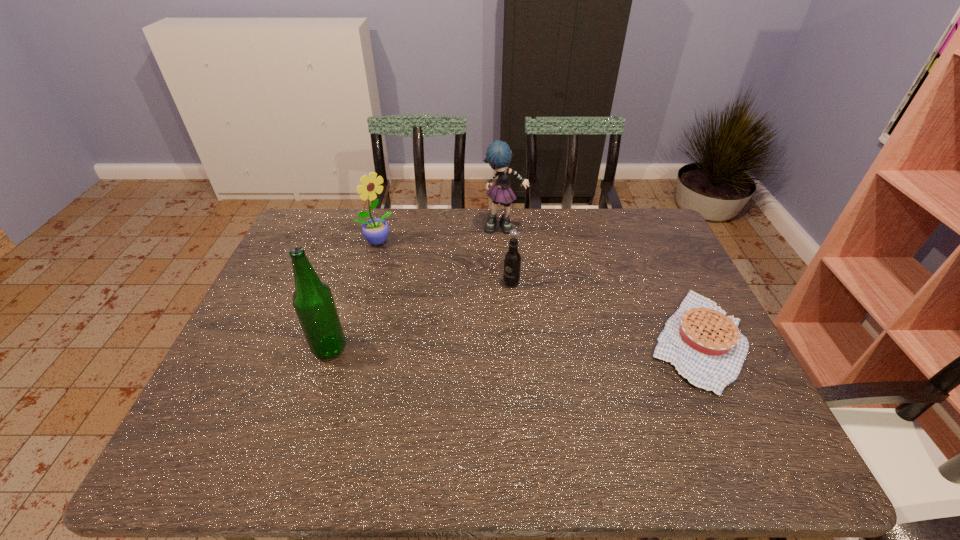
You are a GUI agent. You are given a task and a screenshot of the screen. Output one action in this format:
    pyautogui.click(x=<x>, y=<y>)
    Task: Click on the sunflower that is at the far edge
    This screenshot has height=540, width=960.
    Given the screenshot: What is the action you would take?
    pyautogui.click(x=375, y=231)

Locate an element on the screen. This screenshot has width=960, height=540. object that is at the near edge is located at coordinates (706, 347).

Image resolution: width=960 pixels, height=540 pixels. In order to click on object that is at the right edge in this screenshot , I will do `click(706, 347)`.

Locate an element on the screen. This screenshot has width=960, height=540. object located at the near right corner is located at coordinates (706, 347).

The height and width of the screenshot is (540, 960). I want to click on vacant space at the far edge of the desktop, so coord(586,220).

The image size is (960, 540). In the image, there is a desktop. In order to click on free space at the left edge in this screenshot , I will do `click(236, 359)`.

What are the coordinates of `vacant space at the right edge of the desktop` in the screenshot? It's located at [638, 276].

This screenshot has height=540, width=960. I want to click on free region at the far left corner, so coord(315,250).

Image resolution: width=960 pixels, height=540 pixels. Find the location of `free space at the near left corner of the desktop`. free space at the near left corner of the desktop is located at coordinates (242, 420).

Where is `vacant space at the far right corner`? vacant space at the far right corner is located at coordinates (648, 208).